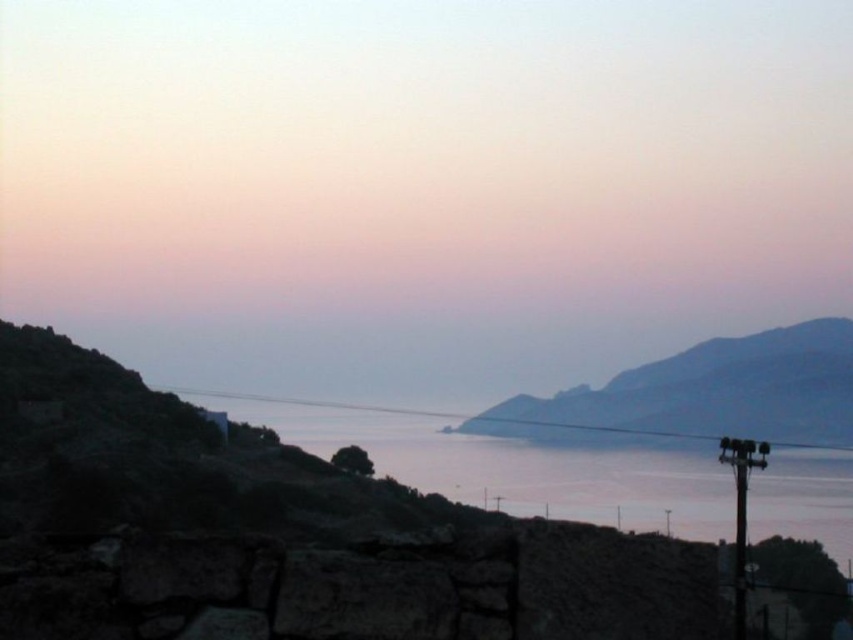
Question: Can you confirm if dark brown stone wall at lower left is wider than smooth gray rock at center?

Choices:
 (A) yes
 (B) no

Answer: (A)

Question: Which of the following is the closest to the observer?

Choices:
 (A) (724, 419)
 (B) (660, 492)
 (C) (9, 132)

Answer: (B)

Question: In this image, where is dark brown stone wall at lower left located relative to smooth gray rock at center?

Choices:
 (A) below
 (B) above

Answer: (A)

Question: Is smooth stone wall at lower left to the left of smooth gray rock at center from the viewer's perspective?

Choices:
 (A) yes
 (B) no

Answer: (A)

Question: Which point is farther from the camera taking this photo?

Choices:
 (A) (564, 625)
 (B) (715, 486)
 (C) (523, 436)

Answer: (C)

Question: Based on their relative distances, which object is nearer to the dark brown stone wall at lower left?

Choices:
 (A) smooth gray rock at center
 (B) smooth stone wall at lower left
 (C) clear water at center

Answer: (C)